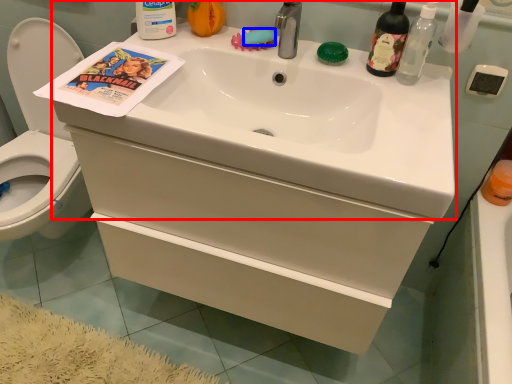
Question: Which object is further to the camera taking this photo, sink (highlighted by a red box) or soap (highlighted by a blue box)?

Choices:
 (A) sink
 (B) soap

Answer: (B)